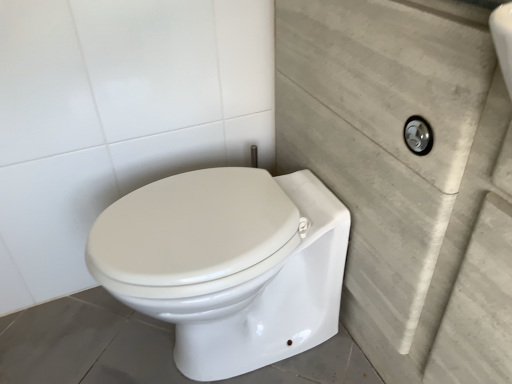
Locate an element on the screen. vacant space situated above white glossy bidet at center (from a real-world perspective) is located at coordinates (203, 212).